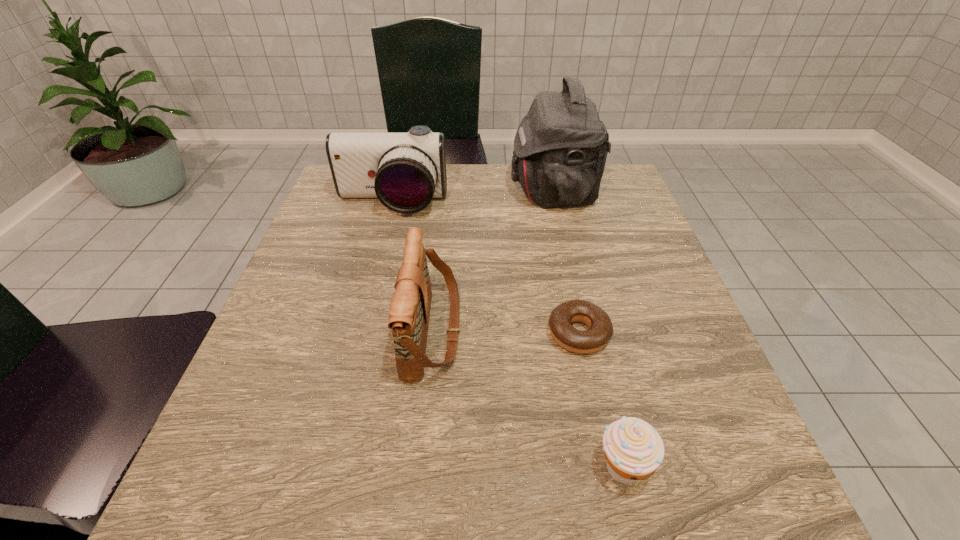
Locate an element on the screen. free space that satisfies the following two spatial constraints: 1. on the front-facing side of the left shoulder bag; 2. on the right side of the shortest object is located at coordinates (432, 334).

Find the location of `vacant space that satisfies the following two spatial constraints: 1. on the surface of the nearest object; 2. on the left side of the camcorder`. vacant space that satisfies the following two spatial constraints: 1. on the surface of the nearest object; 2. on the left side of the camcorder is located at coordinates (323, 467).

The height and width of the screenshot is (540, 960). Identify the location of vacant space that satisfies the following two spatial constraints: 1. on the front-facing side of the nearer shoulder bag; 2. on the right side of the fourth tallest object. (419, 467).

This screenshot has width=960, height=540. I want to click on vacant space that satisfies the following two spatial constraints: 1. on the back side of the shortest object; 2. on the front-facing side of the shorter shoulder bag, so click(x=578, y=332).

At what (x,y) coordinates should I click in order to perform the action: click on vacant area in the image that satisfies the following two spatial constraints: 1. on the surface of the shortest object; 2. on the left side of the camcorder. Please return your answer as a coordinate pair (x, y). The width and height of the screenshot is (960, 540). Looking at the image, I should click on (357, 334).

The width and height of the screenshot is (960, 540). Identify the location of free point that satisfies the following two spatial constraints: 1. on the front-facing side of the muffin; 2. on the left side of the shorter shoulder bag. tap(419, 467).

You are a GUI agent. You are given a task and a screenshot of the screen. Output one action in this format:
    pyautogui.click(x=<x>, y=<y>)
    Task: Click on the free space in the image that satisfies the following two spatial constraints: 1. on the surface of the camcorder; 2. on the right side of the second shortest object
    This screenshot has height=540, width=960.
    Given the screenshot: What is the action you would take?
    click(x=323, y=467)

The image size is (960, 540). What are the coordinates of `free spot that satisfies the following two spatial constraints: 1. on the open flap of the right shoulder bag; 2. on the surface of the camcorder` in the screenshot? It's located at (556, 204).

Where is `free space that satisfies the following two spatial constraints: 1. on the front-facing side of the left shoulder bag; 2. on the right side of the nearest object`? The width and height of the screenshot is (960, 540). free space that satisfies the following two spatial constraints: 1. on the front-facing side of the left shoulder bag; 2. on the right side of the nearest object is located at coordinates (419, 467).

Image resolution: width=960 pixels, height=540 pixels. I want to click on free space that satisfies the following two spatial constraints: 1. on the open flap of the muffin; 2. on the right side of the farther shoulder bag, so click(615, 467).